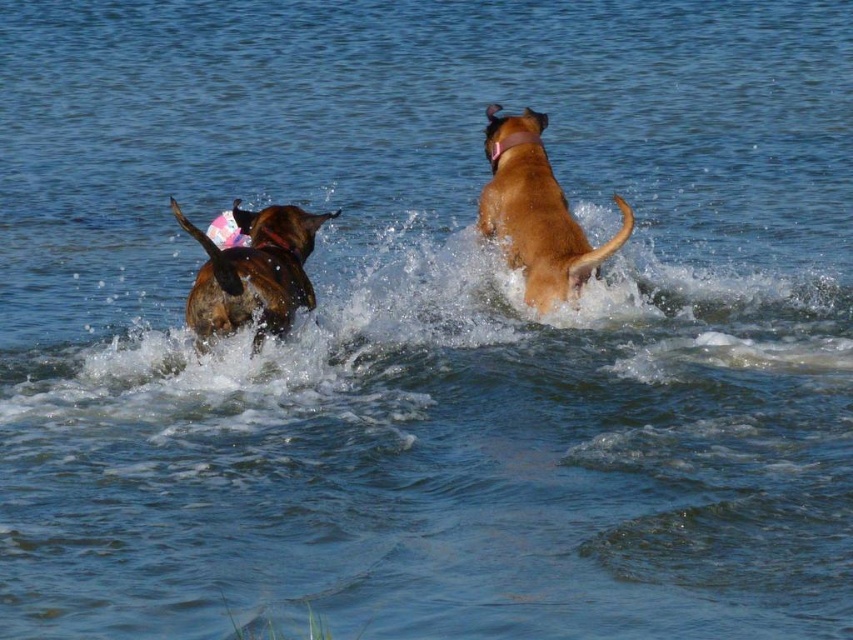
You are standing at the origin point of the image. Where is the brown matte dog at upper right located in terms of coordinates?

The brown matte dog at upper right is located at point coordinates of (537, 212).

You are a photographer trying to capture the perfect shot of the brown matte dog at upper right. You notice that the dog is moving towards the point marked at coordinates point (537, 212). Based on the scene description, where should you position yourself to ensure the dog stays in frame?

The point (537, 212) indicates the location of the brown matte dog at upper right. To keep the dog in frame, position yourself slightly above and to the right of this point, facing towards the center of the water where the action is occurring.